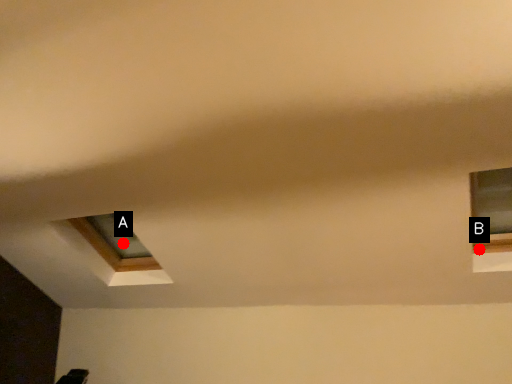
Question: Two points are circled on the image, labeled by A and B beside each circle. Which point appears farthest from the camera in this image?

Choices:
 (A) A is further
 (B) B is further

Answer: (A)